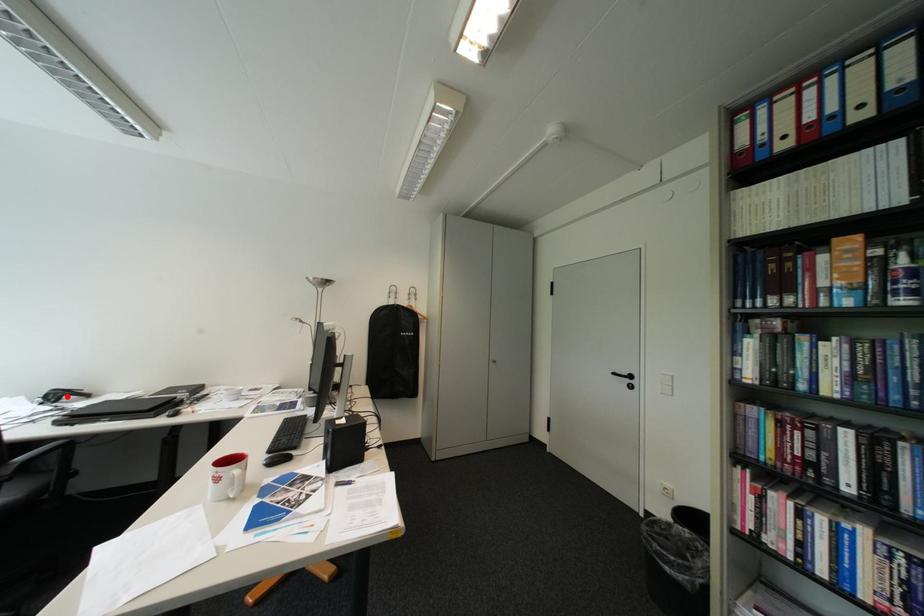
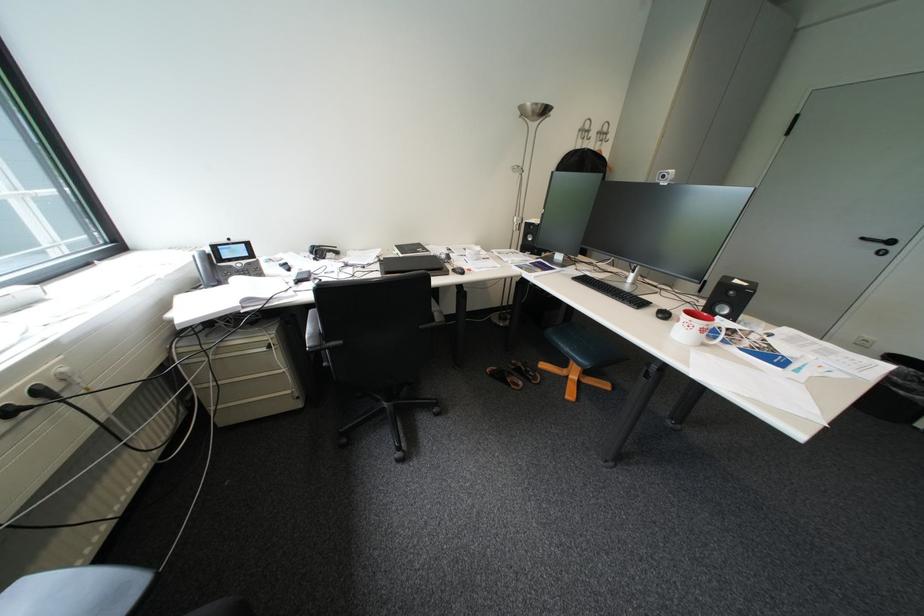
Question: I am providing you with two images of the same scene from different viewpoints. A red point is marked on the first image. At the location where the point appears in image 1, is it still visible in image 2?

Choices:
 (A) Yes
 (B) No

Answer: (A)